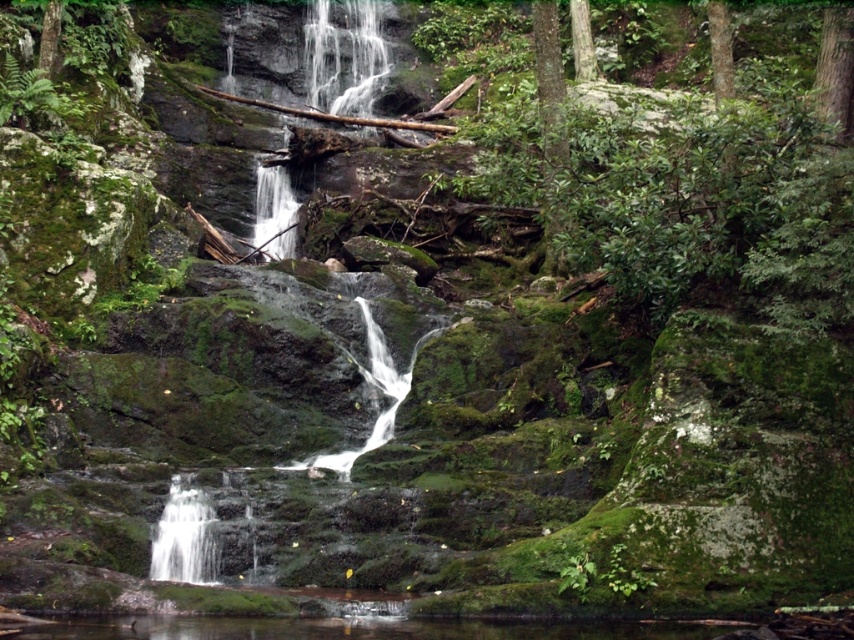
Question: Which object is farther from the camera taking this photo?

Choices:
 (A) white smooth waterfall at lower left
 (B) clear water at center

Answer: (B)

Question: Is the position of white frothy water at upper center less distant than that of white smooth waterfall at lower left?

Choices:
 (A) no
 (B) yes

Answer: (A)

Question: Can you confirm if white frothy water at upper center is positioned below green rough bark tree at upper right?

Choices:
 (A) yes
 (B) no

Answer: (B)

Question: Which of the following is the farthest from the observer?

Choices:
 (A) white smooth waterfall at lower left
 (B) green rough bark tree at upper right

Answer: (B)

Question: Which point appears closest to the camera in this image?

Choices:
 (A) (367, 93)
 (B) (180, 481)
 (C) (847, 104)

Answer: (B)

Question: Can you confirm if green mossy tree at upper right is smaller than green rough bark tree at upper right?

Choices:
 (A) no
 (B) yes

Answer: (A)